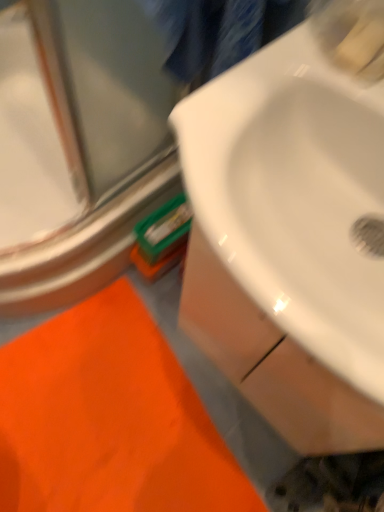
I want to click on blank space situated above orange fabric bath mat at lower left (from a real-world perspective), so click(x=103, y=424).